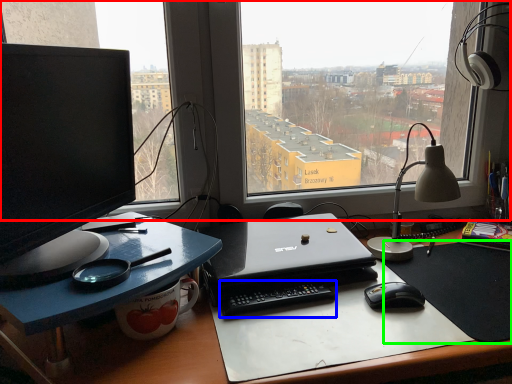
Question: Considering the real-world distances, which object is closest to window (highlighted by a red box)? laptop keyboard (highlighted by a blue box) or mousepad (highlighted by a green box).

Choices:
 (A) laptop keyboard
 (B) mousepad

Answer: (B)